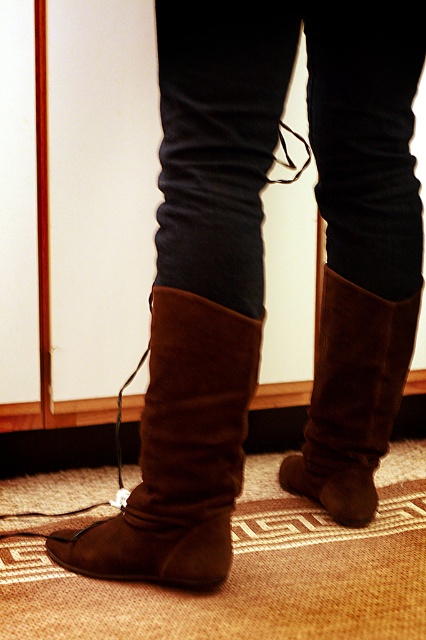
Which is in front, point (167, 340) or point (399, 308)?

Positioned in front is point (167, 340).

Does point (218, 433) come farther from viewer compared to point (394, 385)?

No, (218, 433) is in front of (394, 385).

Between point (146, 392) and point (373, 422), which one is positioned behind?

Point (373, 422)

Locate an element on the screen. suede boot at lower left is located at coordinates (180, 452).